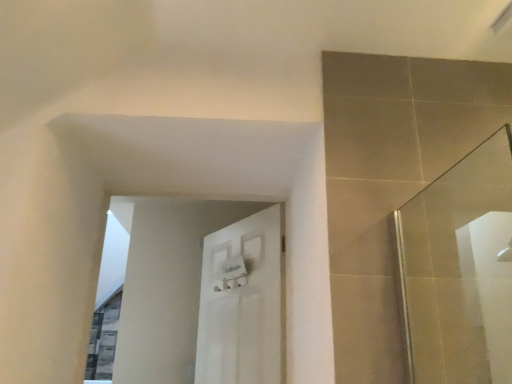
Measure the distance between white matte door at center and camera.

white matte door at center is 1.79 meters from camera.

In order to click on white matte door at center in this screenshot , I will do `click(242, 302)`.

In order to face white matte door at center, should I rotate leftwards or rightwards?

A 1.529 degree turn to the left will do.

What do you see at coordinates (242, 302) in the screenshot? I see `white matte door at center` at bounding box center [242, 302].

This screenshot has height=384, width=512. I want to click on white matte door at center, so click(x=242, y=302).